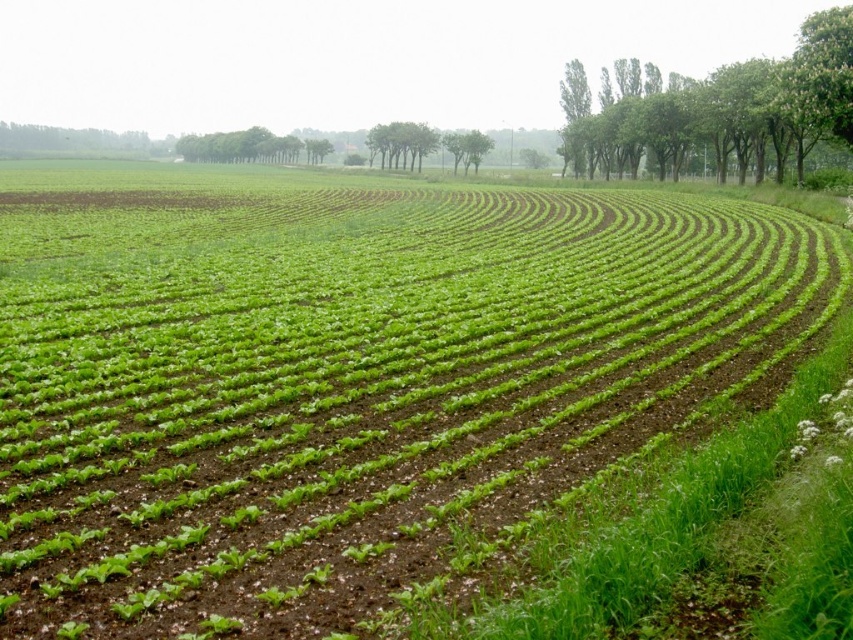
Question: From the image, what is the correct spatial relationship of green leafy trees at upper center in relation to green leafy plant at center?

Choices:
 (A) below
 (B) above

Answer: (B)

Question: Among these objects, which one is farthest from the camera?

Choices:
 (A) green leafy trees at upper center
 (B) green leafy plant at center
 (C) green leafy trees at upper right
 (D) green leafy trees at center

Answer: (A)

Question: Which point appears closest to the camera in this image?

Choices:
 (A) (412, 132)
 (B) (837, 12)

Answer: (B)

Question: Which of the following is the farthest from the observer?

Choices:
 (A) green leafy plant at center
 (B) green leafy trees at center

Answer: (A)

Question: Can you confirm if green leafy trees at upper right is bigger than green leafy trees at upper center?

Choices:
 (A) no
 (B) yes

Answer: (A)

Question: Does green leafy trees at upper center have a greater width compared to green leafy trees at center?

Choices:
 (A) yes
 (B) no

Answer: (A)